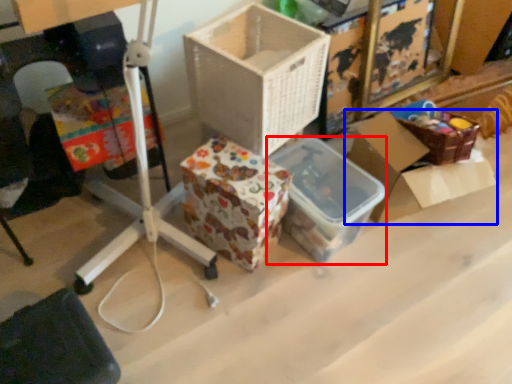
Question: Which of the following is the farthest to the observer, storage box (highlighted by a red box) or box (highlighted by a blue box)?

Choices:
 (A) storage box
 (B) box

Answer: (B)